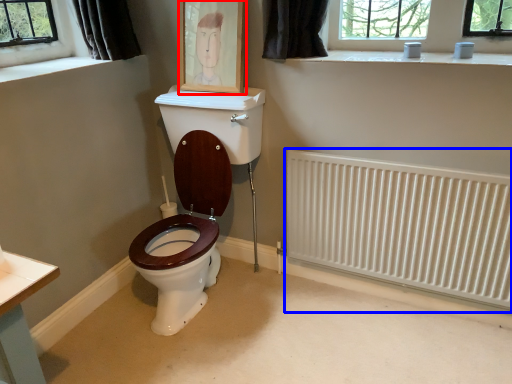
Question: Which object appears closest to the camera in this image, picture frame (highlighted by a red box) or radiator (highlighted by a blue box)?

Choices:
 (A) picture frame
 (B) radiator

Answer: (B)